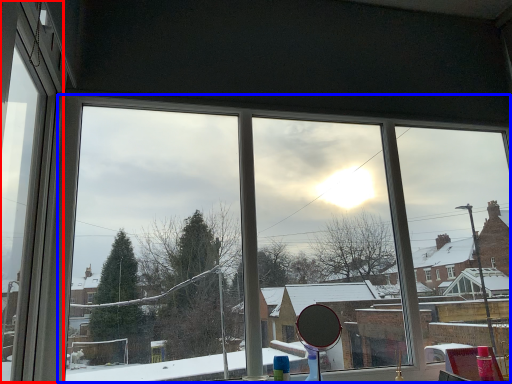
Question: Which object is closer to the camera taking this photo, window frame (highlighted by a red box) or bay window (highlighted by a blue box)?

Choices:
 (A) window frame
 (B) bay window

Answer: (A)